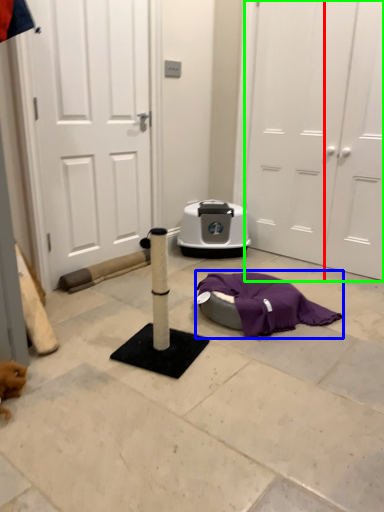
Question: Which object is positioned farthest from door (highlighted by a red box)? Select from blanket (highlighted by a blue box) and door (highlighted by a green box).

Choices:
 (A) blanket
 (B) door

Answer: (A)